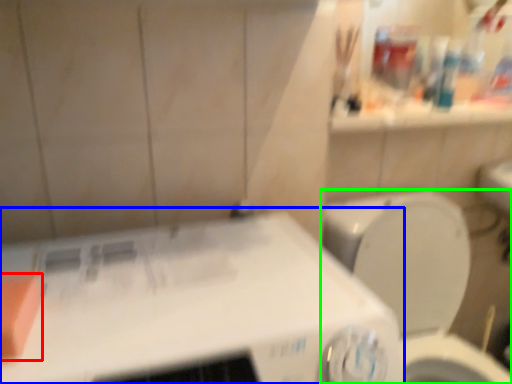
Question: Which is farther away from soap (highlighted by a red box)? appliance (highlighted by a blue box) or toilet (highlighted by a green box)?

Choices:
 (A) appliance
 (B) toilet

Answer: (B)